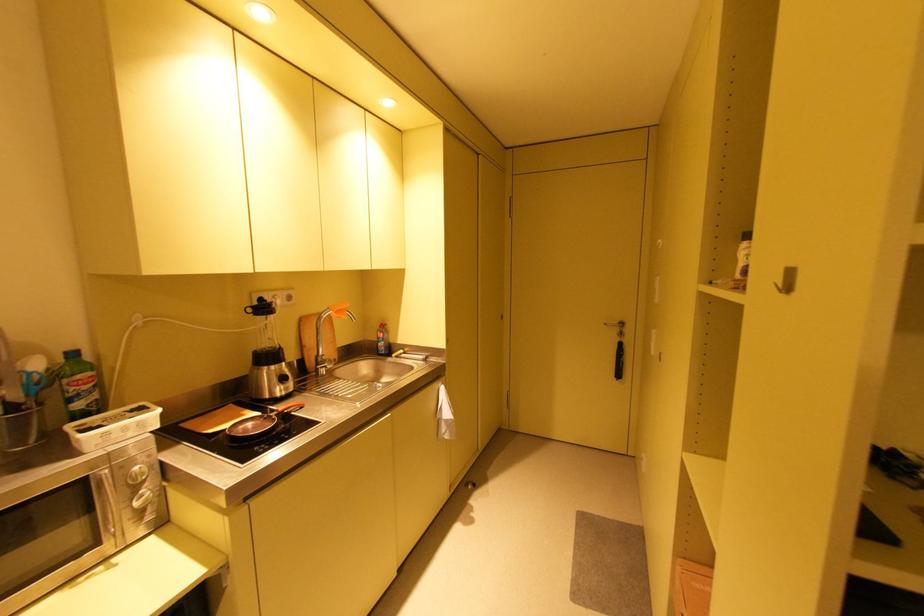
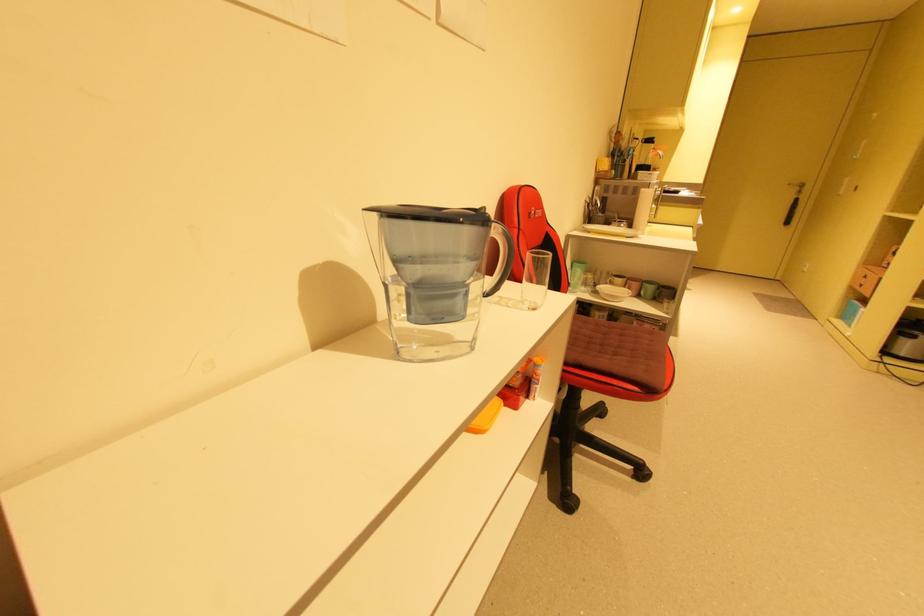
What movement of the cameraman would produce the second image?

The movement direction of the cameraman is left, backward.